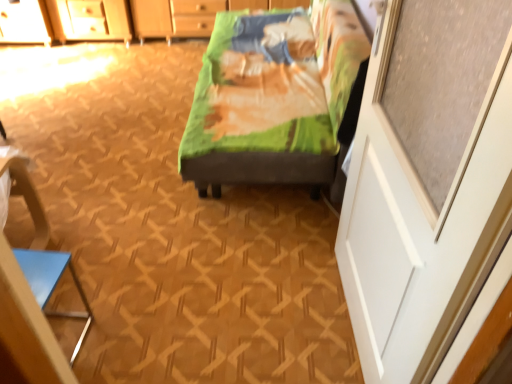
Question: From a real-world perspective, is white matte screen door at right above or below blue glossy triangle at lower left?

Choices:
 (A) below
 (B) above

Answer: (B)

Question: Choose the correct answer: Is white matte screen door at right inside blue glossy triangle at lower left or outside it?

Choices:
 (A) inside
 (B) outside

Answer: (B)

Question: Which object is positioned closest to the blue glossy triangle at lower left?

Choices:
 (A) white matte screen door at right
 (B) green fabric bed at center

Answer: (B)

Question: Which object is the closest to the green fabric bed at center?

Choices:
 (A) blue glossy triangle at lower left
 (B) white matte screen door at right

Answer: (B)